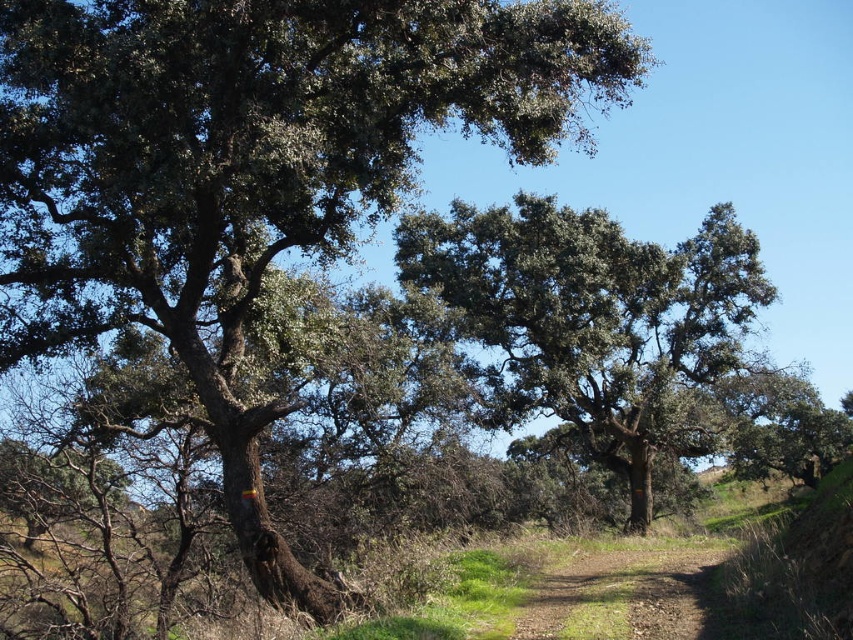
Does green leafy tree at center appear on the left side of brown dirt track at center?

In fact, green leafy tree at center is to the right of brown dirt track at center.

Who is taller, green leafy tree at center or brown dirt track at center?

Standing taller between the two is green leafy tree at center.

Is point (621, 419) positioned before point (610, 625)?

No, it is behind (610, 625).

At what (x,y) coordinates should I click in order to perform the action: click on green leafy tree at center. Please return your answer as a coordinate pair (x, y). Looking at the image, I should click on (595, 321).